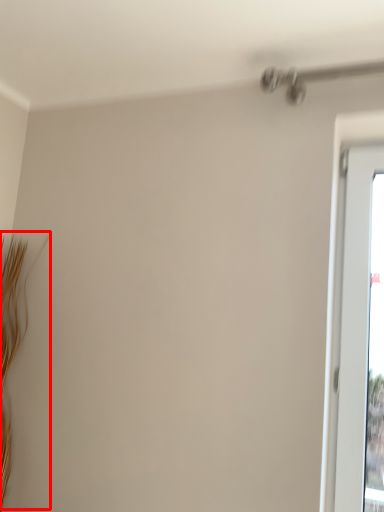
Question: From the image's perspective, where is twig (annotated by the red box) located in relation to window screen in the image?

Choices:
 (A) below
 (B) above

Answer: (A)